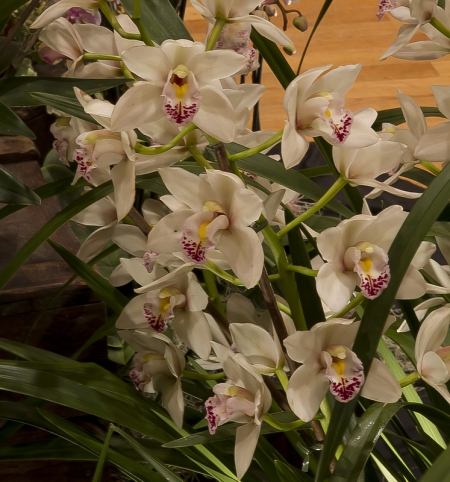
Find the location of `floor`. floor is located at coordinates (361, 48).